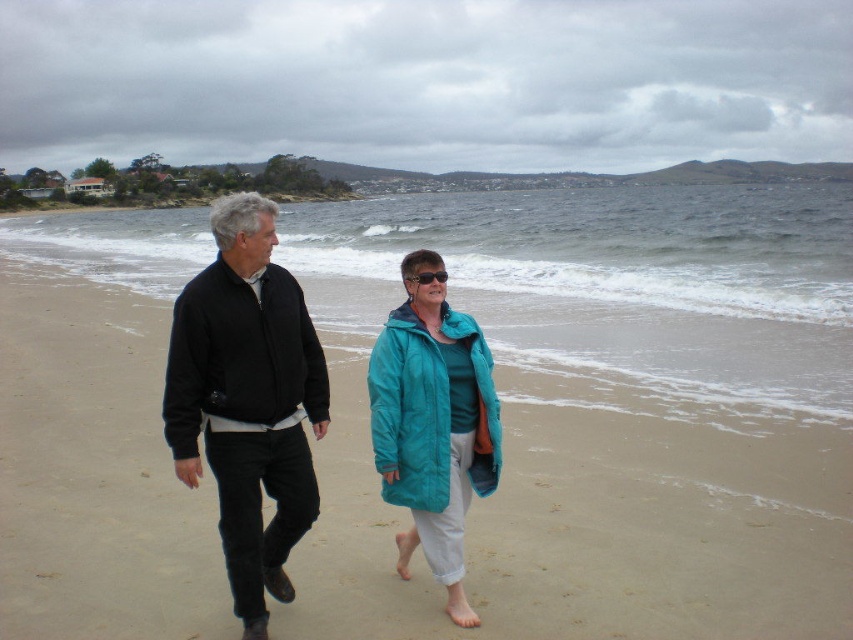
Consider the image. You are standing on the beach and want to walk from the black cotton jacket at left to the beige sand at center. Which direction should you move in?

The beige sand at center is to the right of the black cotton jacket at left, so you should move to the right to reach it.

You are standing on the beach and see two points marked on the sand. The first point is at coordinates point (x=90, y=307) and the second is at point (x=238, y=211). If you want to reach the point that is closer to you, which one should you go to?

You should go to point (x=90, y=307) because it is closer to you than point (x=238, y=211).

You are standing on the beach and see the black cotton jacket at left and the teal puffy coat at center. Which one is positioned more to the left side of the scene?

The black cotton jacket at left is positioned more to the left side of the scene than the teal puffy coat at center.